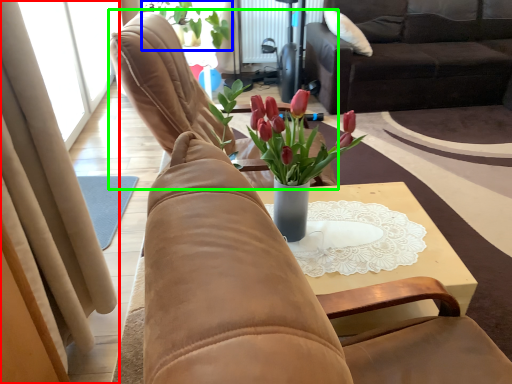
Question: Considering the real-world distances, which object is farthest from curtain (highlighted by a red box)? houseplant (highlighted by a blue box) or chair (highlighted by a green box)?

Choices:
 (A) houseplant
 (B) chair

Answer: (A)